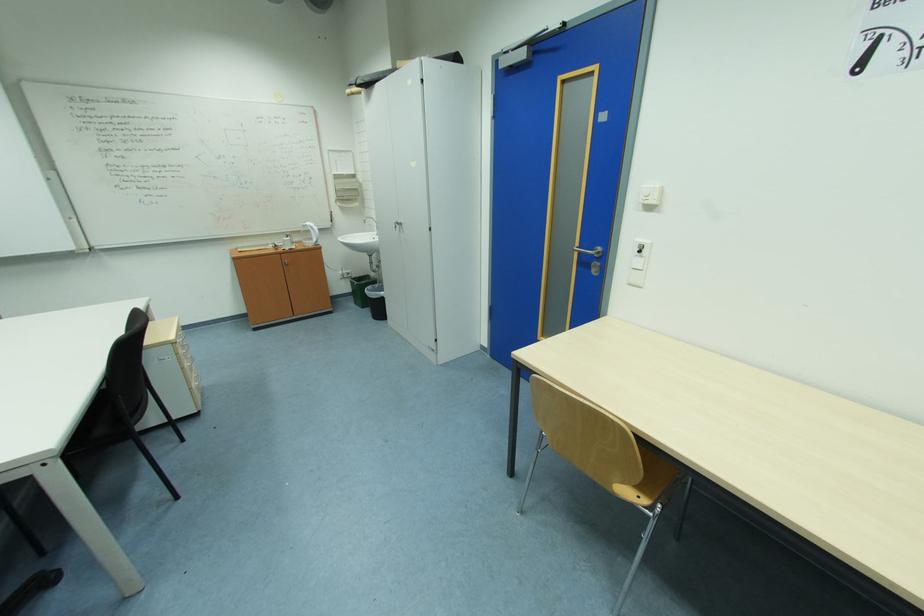
Identify the location of metal door handle. The image size is (924, 616). (590, 251).